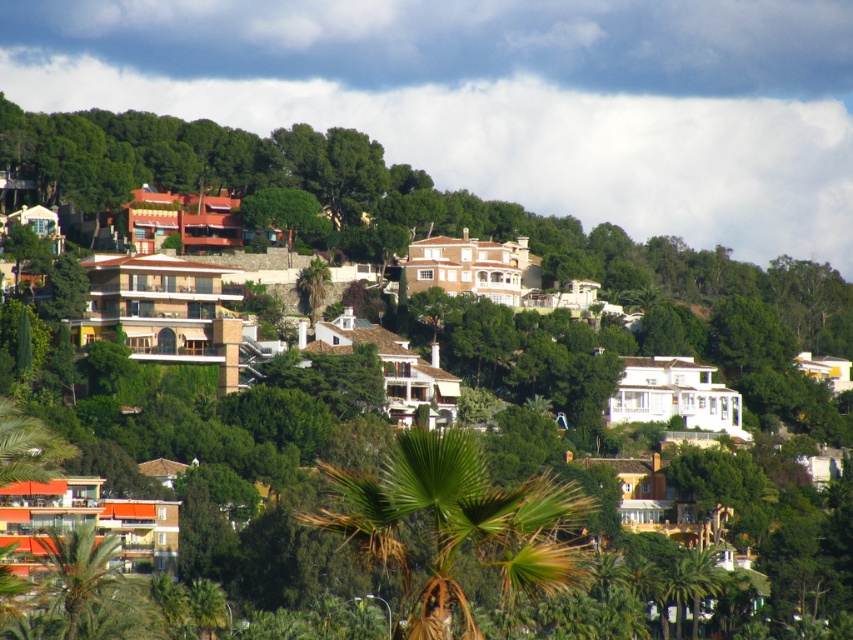
You are a drone operator planning to capture aerial footage of the hillside community. You need to ensure that the white fluffy cloud at upper center does not block the view of the green leafy palm tree at center. Based on their positions, is this possible?

The white fluffy cloud at upper center is positioned over the green leafy palm tree at center, so it will block the view of the palm tree. To avoid obstruction, adjust the drone angle or position to capture the palm tree without the cloud covering it.

You are standing at the top of the hillside community and want to determine which of the two points, point (683, 74) or point (67, 579), is closer to you. Based on the spatial arrangement of the hillside, which point is nearer?

Point (683, 74) is further to the viewer than point (67, 579). Therefore, point (67, 579) is closer to you.

You are navigating through the hillside community and want to reach the point at coordinates point (815,148) from point (537,516). Based on the image, which direction should you move to get closer to your destination?

You should move forward because point (815,148) is behind point (537,516), so moving towards the direction away from the viewer will bring you closer to it.